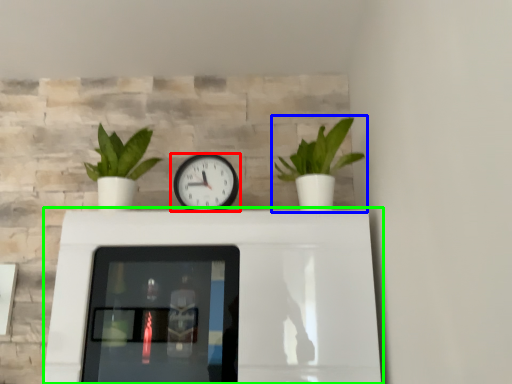
Question: Estimate the real-world distances between objects in this image. Which object is farther from wall clock (highlighted by a red box), houseplant (highlighted by a blue box) or table (highlighted by a green box)?

Choices:
 (A) houseplant
 (B) table

Answer: (B)